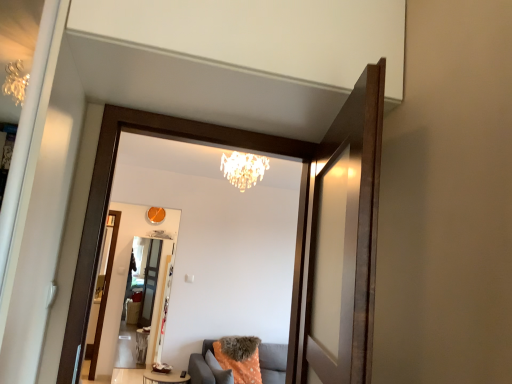
Question: Considering the relative positions of matte wooden mirror at center and crystal chandelier at upper center in the image provided, is matte wooden mirror at center in front of crystal chandelier at upper center?

Choices:
 (A) yes
 (B) no

Answer: (A)

Question: From a real-world perspective, does matte wooden mirror at center sit lower than crystal chandelier at upper center?

Choices:
 (A) no
 (B) yes

Answer: (B)

Question: Does matte wooden mirror at center have a lesser width compared to crystal chandelier at upper center?

Choices:
 (A) yes
 (B) no

Answer: (A)

Question: From a real-world perspective, is matte wooden mirror at center positioned over crystal chandelier at upper center based on gravity?

Choices:
 (A) yes
 (B) no

Answer: (B)

Question: Does matte wooden mirror at center have a larger size compared to crystal chandelier at upper center?

Choices:
 (A) yes
 (B) no

Answer: (A)

Question: Does matte wooden mirror at center have a smaller size compared to crystal chandelier at upper center?

Choices:
 (A) no
 (B) yes

Answer: (A)

Question: Is wooden round table at center located outside crystal chandelier at upper center?

Choices:
 (A) no
 (B) yes

Answer: (B)

Question: From a real-world perspective, does wooden round table at center stand above crystal chandelier at upper center?

Choices:
 (A) yes
 (B) no

Answer: (B)

Question: Is wooden round table at center at the left side of crystal chandelier at upper center?

Choices:
 (A) yes
 (B) no

Answer: (A)

Question: From the image's perspective, is wooden round table at center beneath crystal chandelier at upper center?

Choices:
 (A) yes
 (B) no

Answer: (A)

Question: Would you consider wooden round table at center to be distant from crystal chandelier at upper center?

Choices:
 (A) yes
 (B) no

Answer: (A)

Question: Is the surface of wooden round table at center in direct contact with crystal chandelier at upper center?

Choices:
 (A) no
 (B) yes

Answer: (A)

Question: From a real-world perspective, is matte wooden mirror at center on transparent glass screen door at upper center, which is the first screen door in front-to-back order?

Choices:
 (A) yes
 (B) no

Answer: (B)